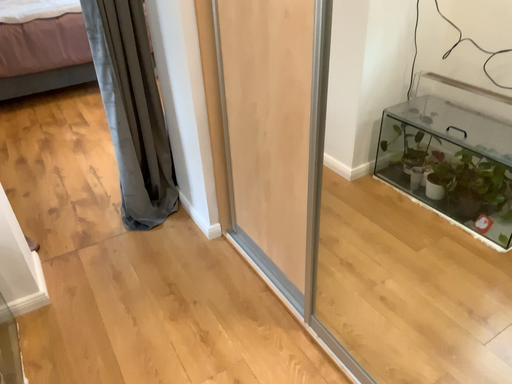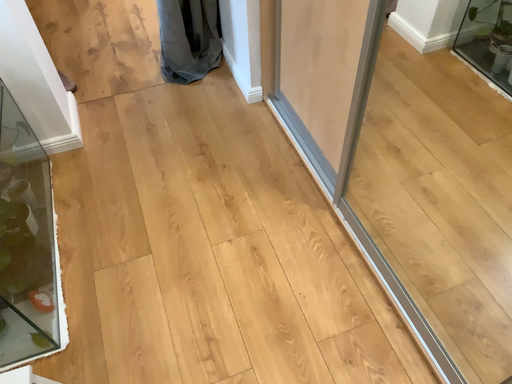
Question: How did the camera likely rotate when shooting the video?

Choices:
 (A) rotated upward
 (B) rotated downward

Answer: (B)